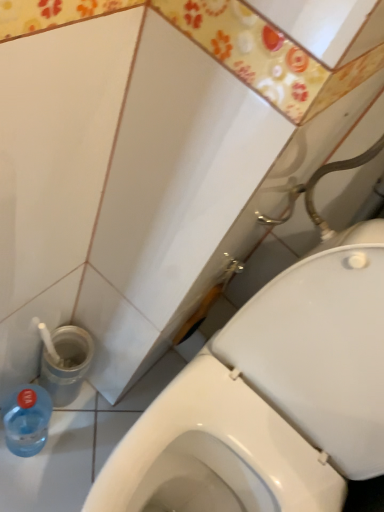
What is the approximate height of white glossy toilet at lower right?

31.90 inches.

The image size is (384, 512). What do you see at coordinates (270, 399) in the screenshot?
I see `white glossy toilet at lower right` at bounding box center [270, 399].

I want to click on white glossy toilet at lower right, so pos(270,399).

Identify the location of white glossy toilet at lower right. This screenshot has width=384, height=512. [x=270, y=399].